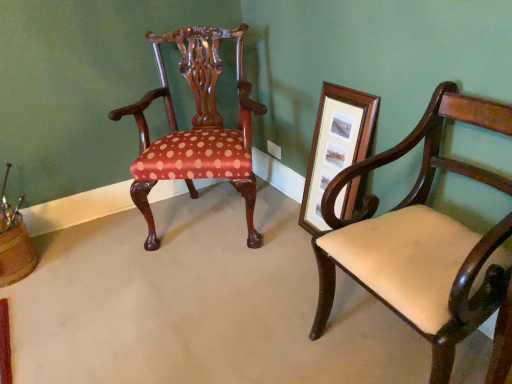
Question: Does wooden picture frame at right appear on the left side of matte cream upholstered chair at right, the first chair in the right-to-left sequence?

Choices:
 (A) no
 (B) yes

Answer: (B)

Question: Is wooden picture frame at right positioned behind matte cream upholstered chair at right, which is counted as the second chair, starting from the back?

Choices:
 (A) no
 (B) yes

Answer: (B)

Question: Are wooden picture frame at right and matte cream upholstered chair at right, which is counted as the second chair, starting from the back, far apart?

Choices:
 (A) yes
 (B) no

Answer: (B)

Question: From a real-world perspective, is wooden picture frame at right positioned over matte cream upholstered chair at right, marked as the second chair in a left-to-right arrangement, based on gravity?

Choices:
 (A) yes
 (B) no

Answer: (B)

Question: Is wooden picture frame at right positioned before matte cream upholstered chair at right, which is counted as the second chair, starting from the back?

Choices:
 (A) yes
 (B) no

Answer: (B)

Question: Is polished wood chair at center, arranged as the second chair when viewed from the front, wider or thinner than matte cream upholstered chair at right, which is counted as the second chair, starting from the back?

Choices:
 (A) wide
 (B) thin

Answer: (A)

Question: From the image's perspective, is polished wood chair at center, arranged as the second chair when viewed from the front, positioned above or below matte cream upholstered chair at right, which ranks as the 1th chair in front-to-back order?

Choices:
 (A) above
 (B) below

Answer: (A)

Question: Is polished wood chair at center, the first chair from the back, bigger or smaller than matte cream upholstered chair at right, the first chair in the right-to-left sequence?

Choices:
 (A) big
 (B) small

Answer: (A)

Question: From their relative heights in the image, would you say polished wood chair at center, the first chair from the back, is taller or shorter than matte cream upholstered chair at right, which is counted as the second chair, starting from the back?

Choices:
 (A) short
 (B) tall

Answer: (B)

Question: Looking at the image, does matte cream upholstered chair at right, marked as the second chair in a left-to-right arrangement, seem bigger or smaller compared to wooden picture frame at right?

Choices:
 (A) small
 (B) big

Answer: (B)

Question: Is matte cream upholstered chair at right, marked as the second chair in a left-to-right arrangement, wider or thinner than wooden picture frame at right?

Choices:
 (A) wide
 (B) thin

Answer: (A)

Question: From a real-world perspective, is matte cream upholstered chair at right, which ranks as the 1th chair in front-to-back order, above or below wooden picture frame at right?

Choices:
 (A) below
 (B) above

Answer: (B)

Question: Is matte cream upholstered chair at right, marked as the second chair in a left-to-right arrangement, situated inside wooden picture frame at right or outside?

Choices:
 (A) outside
 (B) inside

Answer: (A)

Question: Considering the positions of point (212, 69) and point (339, 168), is point (212, 69) closer or farther from the camera than point (339, 168)?

Choices:
 (A) farther
 (B) closer

Answer: (A)

Question: Looking at the image, does polished wood chair at center, which is counted as the 1th chair, starting from the left, seem bigger or smaller compared to wooden picture frame at right?

Choices:
 (A) big
 (B) small

Answer: (A)